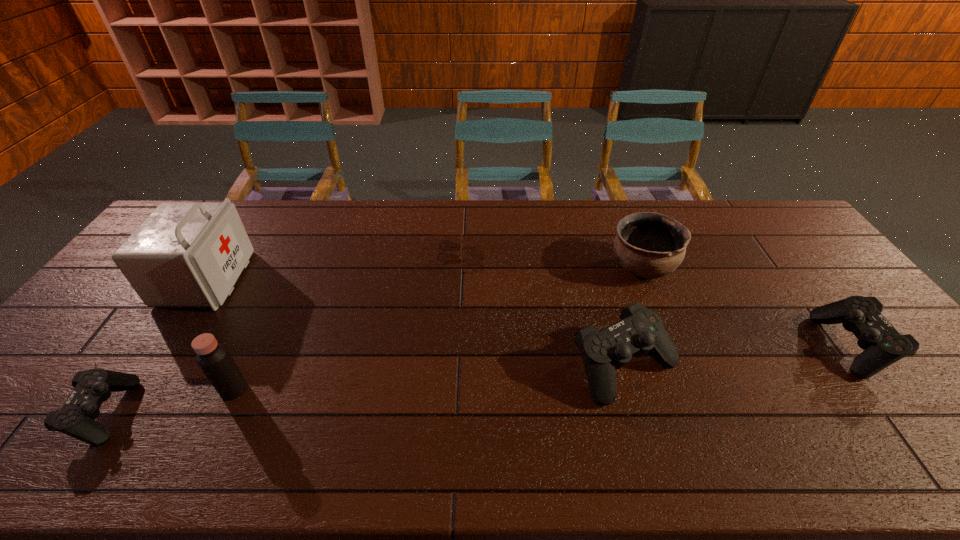
Locate an element on the screen. The height and width of the screenshot is (540, 960). free space between the shortest control and the pottery is located at coordinates (373, 340).

The image size is (960, 540). Identify the location of vacant space in between the fourth tallest object and the leftmost control. (364, 389).

The image size is (960, 540). I want to click on free area in between the fifth tallest object and the third object from left to right, so click(x=543, y=368).

Find the location of a particular element. unoccupied area between the fourth shortest object and the second shortest object is located at coordinates (364, 389).

Identify the location of vacant area that lies between the fourth object from left to right and the second control from left to right. This screenshot has width=960, height=540. (534, 310).

Locate an element on the screen. The width and height of the screenshot is (960, 540). vacant area that lies between the shortest object and the fifth tallest object is located at coordinates (648, 300).

Where is `object that is the closest one to the shortest object`? The height and width of the screenshot is (540, 960). object that is the closest one to the shortest object is located at coordinates (640, 330).

Identify which object is the third nearest to the pottery. Please provide its 2D coordinates. Your answer should be formatted as a tuple, i.e. [(x, y)], where the tuple contains the x and y coordinates of a point satisfying the conditions above.

[(460, 258)]

Find the location of a particular element. This screenshot has height=540, width=960. the third closest control relative to the first-aid kit is located at coordinates (883, 345).

Select which control appears as the closest to the sunglasses. Please provide its 2D coordinates. Your answer should be formatted as a tuple, i.e. [(x, y)], where the tuple contains the x and y coordinates of a point satisfying the conditions above.

[(640, 330)]